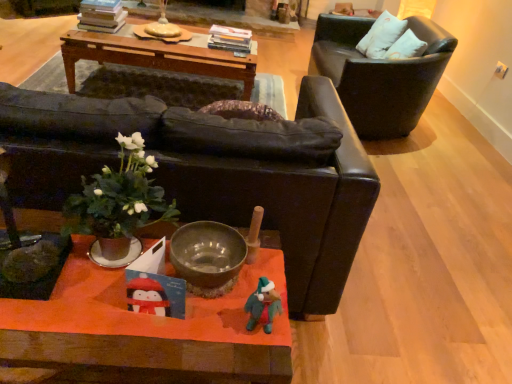
You are a GUI agent. You are given a task and a screenshot of the screen. Output one action in this format:
    pyautogui.click(x=<x>, y=<y>)
    Task: Click on the space that is in front of felt-like green toy at lower center
    This screenshot has width=512, height=384.
    Given the screenshot: What is the action you would take?
    pyautogui.click(x=251, y=363)